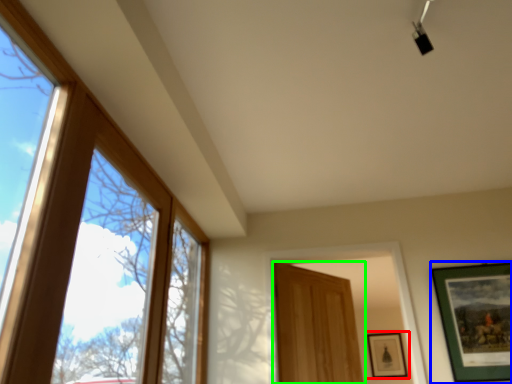
Question: Which object is positioned closest to picture frame (highlighted by a red box)? Select from picture frame (highlighted by a blue box) and door (highlighted by a green box).

Choices:
 (A) picture frame
 (B) door

Answer: (B)